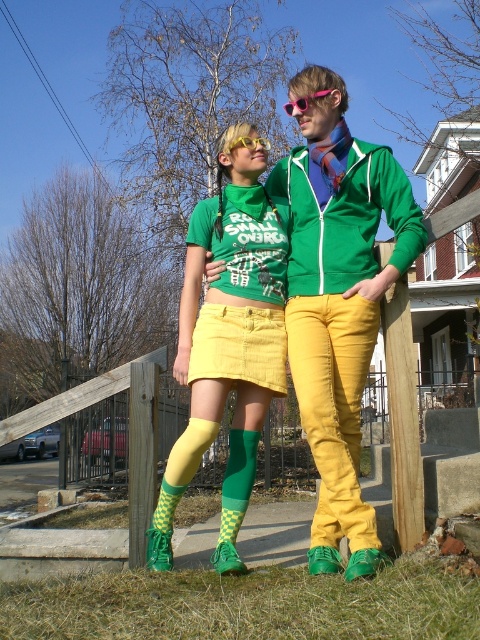
You are standing in the residential area shown in the image and want to determine which of the two points, point (304, 131) or point (243, 342), is closer to you. Based on the scene description, which point is nearer to your current position?

Point (304, 131) is further to the viewer than point (243, 342). Wait, the question asks which is closer to you. If point A is further to the viewer than point B, that means point B is closer to the viewer. So the answer should be point (243, 342) is closer.

You are designing a fashion catalog and need to know which item is wider between the matte green socks at center and the matte yellow skirt at center. Which one should you highlight as wider?

The matte green socks at center is wider than the matte yellow skirt at center according to the description.

You are a photographer trying to capture a closeup shot of the yellow plastic goggles at upper center. You are currently positioned 4 feet away from the matte yellow skirt at center. Do you need to move closer or farther away to get the goggles in focus?

The matte yellow skirt at center is 3.99 feet away from the yellow plastic goggles at upper center. Since you are 4 feet away from the skirt, you need to move 0.01 feet closer to focus on the goggles.